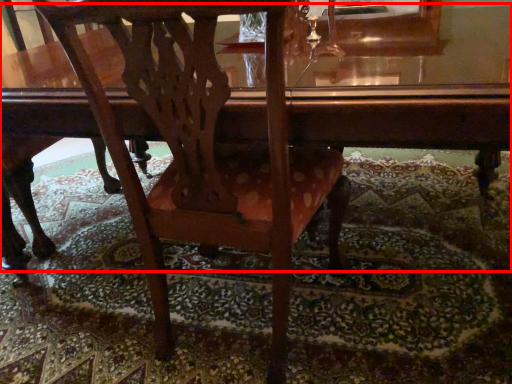
Question: Where is table (annotated by the red box) located in relation to chair in the image?

Choices:
 (A) left
 (B) right

Answer: (B)